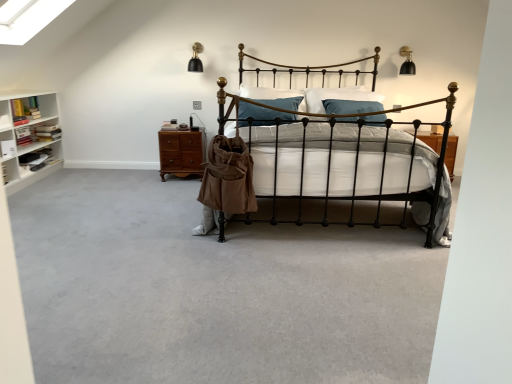
Question: From the image's perspective, relative to brown wood drawer at center, is gray carpet at center above or below?

Choices:
 (A) below
 (B) above

Answer: (A)

Question: Based on their sizes in the image, would you say gray carpet at center is bigger or smaller than brown wood drawer at center?

Choices:
 (A) small
 (B) big

Answer: (B)

Question: Which object is the farthest from the black wrought iron bed at center?

Choices:
 (A) brown wood drawer at center
 (B) teal velvet pillow at center
 (C) gray carpet at center
 (D) tan canvas bag at center
 (E) white wooden bookshelf at left

Answer: (E)

Question: Estimate the real-world distances between objects in this image. Which object is farther from the brown wood drawer at center?

Choices:
 (A) tan canvas bag at center
 (B) white wooden bookshelf at left
 (C) teal velvet pillow at center
 (D) gray carpet at center
 (E) black wrought iron bed at center

Answer: (E)